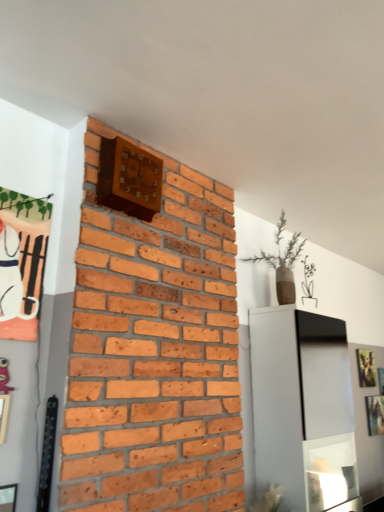
Question: From the image's perspective, is green leafy plant at lower center on top of metallic silver picture frame at upper right, the 1th picture frame from the right?

Choices:
 (A) no
 (B) yes

Answer: (B)

Question: Can you confirm if green leafy plant at lower center is thinner than metallic silver picture frame at upper right, which ranks as the 2th picture frame in front-to-back order?

Choices:
 (A) yes
 (B) no

Answer: (B)

Question: Considering the relative positions of green leafy plant at lower center and metallic silver picture frame at upper right, the 1th picture frame from the right, in the image provided, is green leafy plant at lower center to the left of metallic silver picture frame at upper right, the 1th picture frame from the right, from the viewer's perspective?

Choices:
 (A) no
 (B) yes

Answer: (B)

Question: Can you confirm if green leafy plant at lower center is wider than metallic silver picture frame at upper right, which is the first picture frame in bottom-to-top order?

Choices:
 (A) yes
 (B) no

Answer: (A)

Question: Is green leafy plant at lower center facing towards metallic silver picture frame at upper right, which is the second picture frame in back-to-front order?

Choices:
 (A) no
 (B) yes

Answer: (A)

Question: Is green leafy plant at lower center turned away from metallic silver picture frame at upper right, which appears as the third picture frame when viewed from the left?

Choices:
 (A) no
 (B) yes

Answer: (A)

Question: Is metallic silver picture frame at upper right, which is the first picture frame in bottom-to-top order, behind green leafy plant at lower center?

Choices:
 (A) yes
 (B) no

Answer: (A)

Question: Considering the relative sizes of metallic silver picture frame at upper right, which appears as the third picture frame when viewed from the left, and green leafy plant at lower center in the image provided, is metallic silver picture frame at upper right, which appears as the third picture frame when viewed from the left, shorter than green leafy plant at lower center?

Choices:
 (A) yes
 (B) no

Answer: (B)

Question: From a real-world perspective, is metallic silver picture frame at upper right, which appears as the third picture frame when viewed from the left, under green leafy plant at lower center?

Choices:
 (A) yes
 (B) no

Answer: (B)

Question: Can you confirm if metallic silver picture frame at upper right, the 1th picture frame from the right, is smaller than green leafy plant at lower center?

Choices:
 (A) no
 (B) yes

Answer: (B)

Question: From a real-world perspective, is metallic silver picture frame at upper right, the third picture frame when ordered from top to bottom, positioned over green leafy plant at lower center based on gravity?

Choices:
 (A) yes
 (B) no

Answer: (A)

Question: Is metallic silver picture frame at upper right, which appears as the third picture frame when viewed from the left, not inside green leafy plant at lower center?

Choices:
 (A) no
 (B) yes

Answer: (B)

Question: Could metallic silver picture frame at upper right, which appears as the third picture frame when viewed from the left, be considered to be inside gold metallic picture frame at upper right, the first picture frame from the back?

Choices:
 (A) no
 (B) yes

Answer: (A)